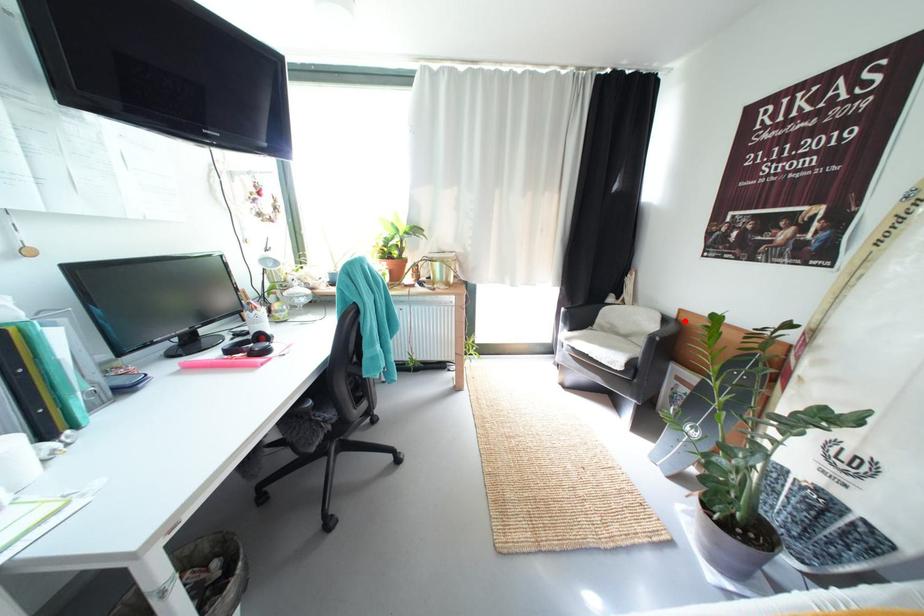
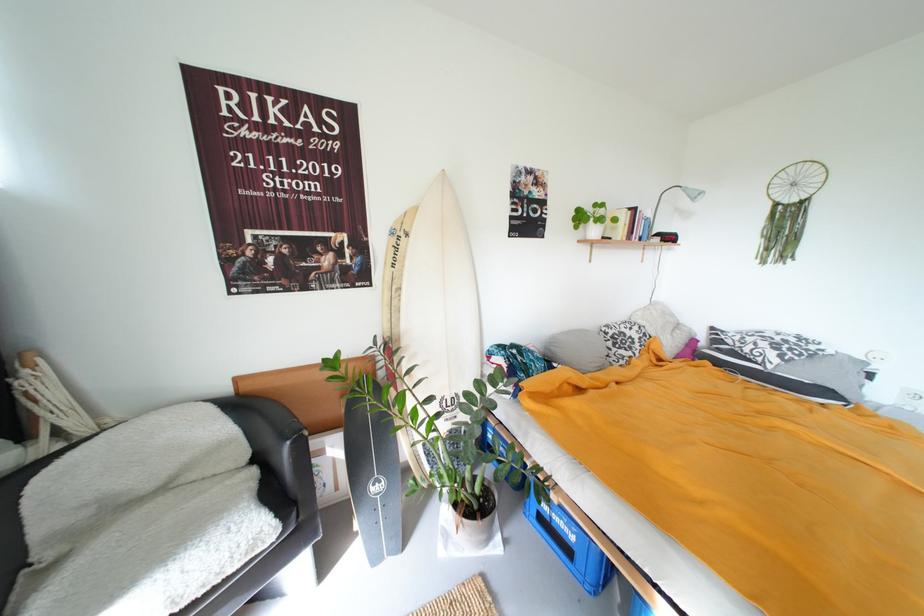
Find the pixel in the second image that matches the highlighted location in the first image.

(246, 395)